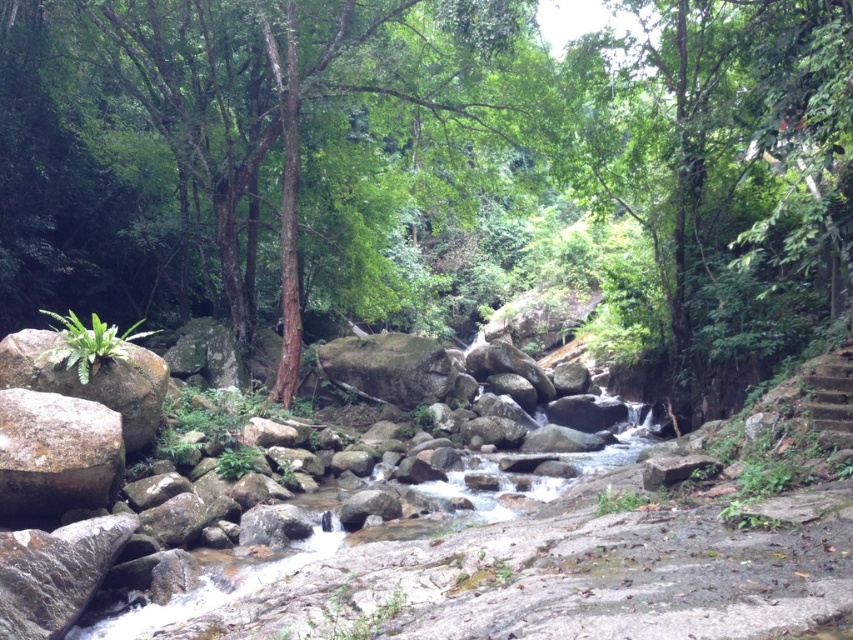
You are a hiker trying to cross the stream in the image. You need to decide whether to step on the green leafy tree at center or the gray rough boulder at left. Which object is more suitable for stepping on based on their size?

The green leafy tree at center is larger in size than the gray rough boulder at left, so it provides a more stable surface for stepping on.

You are standing at the edge of the stream in the forest scene. You want to take a photo of the green leafy tree at center. If your camera has a maximum focus range of 10 meters, will you be able to capture the tree clearly?

The green leafy tree at center is 8.95 meters away from the viewer. Since the camera can focus up to 10 meters, it is within the range, so yes, you can capture the tree clearly.

From the picture: You are standing at the origin point in the image. Where is the green leafy tree at center located in terms of coordinates?

The green leafy tree at center is located at coordinates point (434, 170).